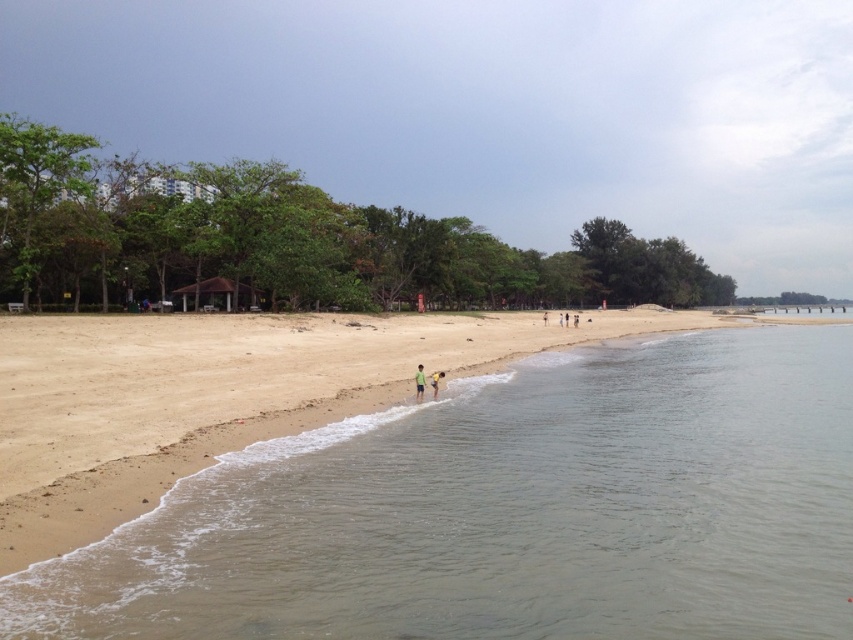
Question: Among these points, which one is nearest to the camera?

Choices:
 (A) (515, 442)
 (B) (432, 385)

Answer: (A)

Question: Which point is closer to the camera?

Choices:
 (A) (434, 397)
 (B) (767, 392)

Answer: (A)

Question: Which of the following is the farthest from the observer?

Choices:
 (A) (190, 541)
 (B) (421, 378)

Answer: (B)

Question: Is brown sand at lower left wider than green matte shirt at center?

Choices:
 (A) no
 (B) yes

Answer: (B)

Question: Does brown sand at lower left lie behind green matte shirt at center?

Choices:
 (A) yes
 (B) no

Answer: (B)

Question: Can you confirm if yellow fabric at lower center is wider than green matte shirt at center?

Choices:
 (A) no
 (B) yes

Answer: (B)